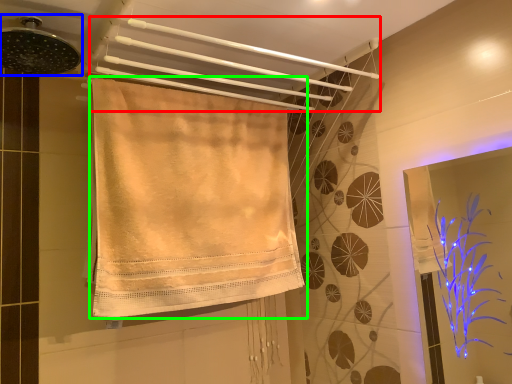
Question: Estimate the real-world distances between objects in this image. Which object is farther from towel (highlighted by a red box), shower (highlighted by a blue box) or towel (highlighted by a green box)?

Choices:
 (A) shower
 (B) towel

Answer: (A)